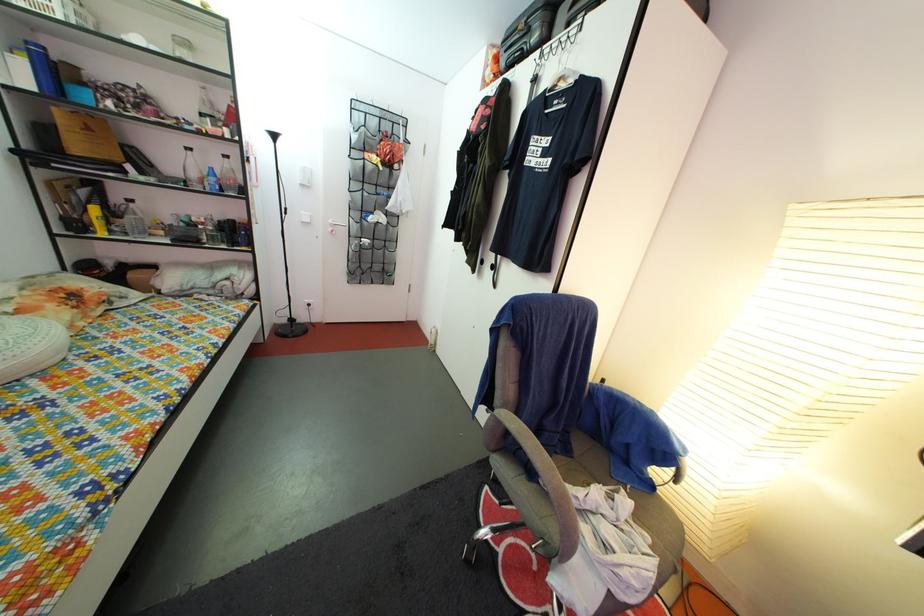
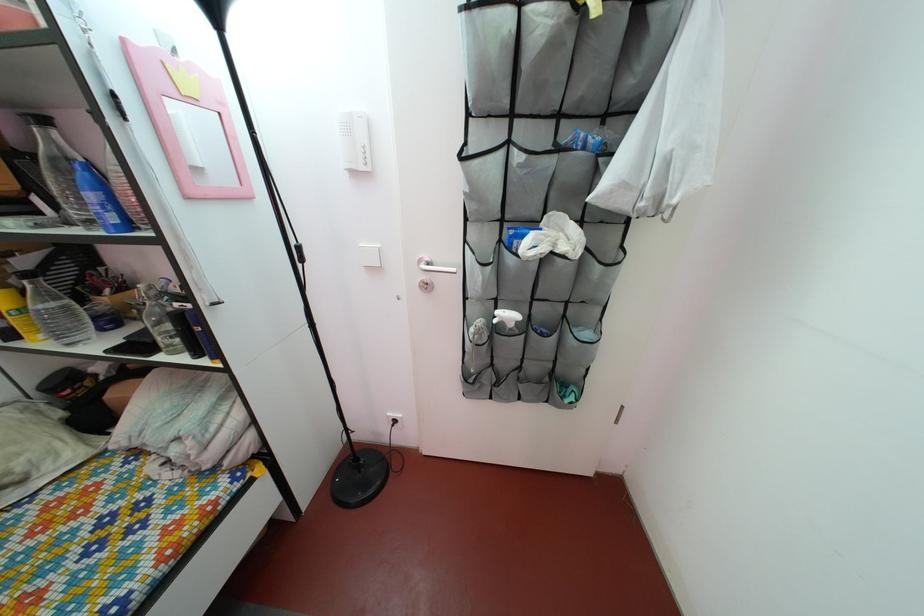
The point at (152,180) is marked in the first image. Where is the corresponding point in the second image?

(68, 217)